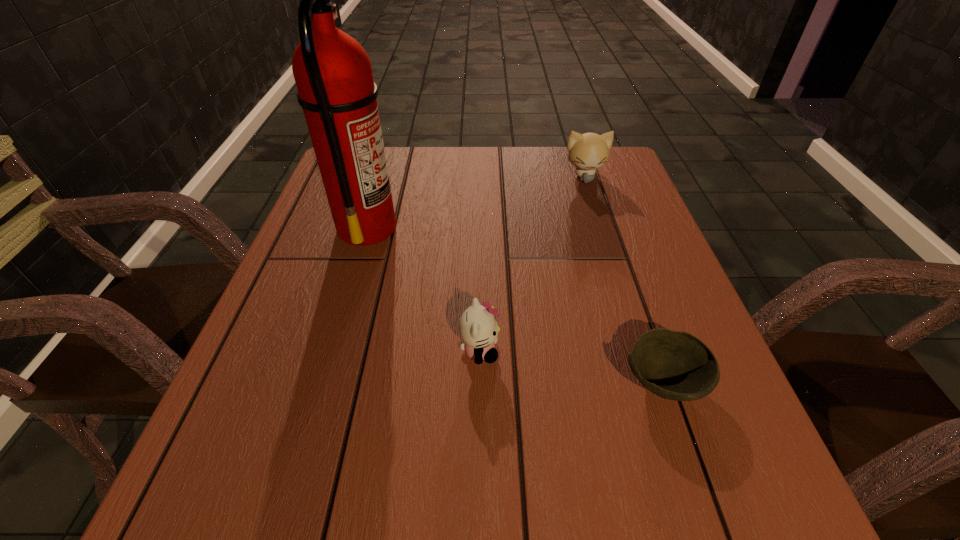
At what (x,y) coordinates should I click in order to perform the action: click on vacant space positioned on the back of the bowl. Please return your answer as a coordinate pair (x, y). Looking at the image, I should click on (615, 244).

Find the location of `object present at the far edge`. object present at the far edge is located at coordinates (589, 151).

What are the coordinates of `object located at the left edge` in the screenshot? It's located at (332, 71).

This screenshot has width=960, height=540. Identify the location of kitten located in the right edge section of the desktop. (589, 151).

This screenshot has width=960, height=540. I want to click on bowl present at the right edge, so click(x=675, y=365).

In order to click on object that is at the far right corner in this screenshot , I will do `click(589, 151)`.

The height and width of the screenshot is (540, 960). I want to click on free space at the far edge, so click(539, 154).

I want to click on vacant space at the near edge, so click(x=602, y=472).

Where is `vacant space at the left edge of the desktop`? Image resolution: width=960 pixels, height=540 pixels. vacant space at the left edge of the desktop is located at coordinates (x=319, y=297).

You are a GUI agent. You are given a task and a screenshot of the screen. Output one action in this format:
    pyautogui.click(x=<x>, y=<y>)
    Task: Click on the free space at the right edge of the desktop
    The width and height of the screenshot is (960, 540).
    Given the screenshot: What is the action you would take?
    pyautogui.click(x=628, y=198)